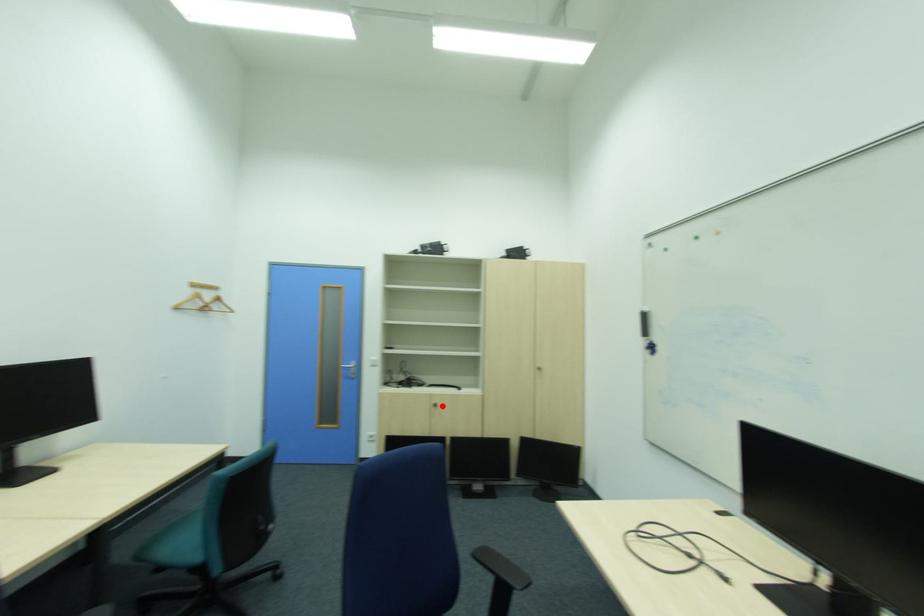
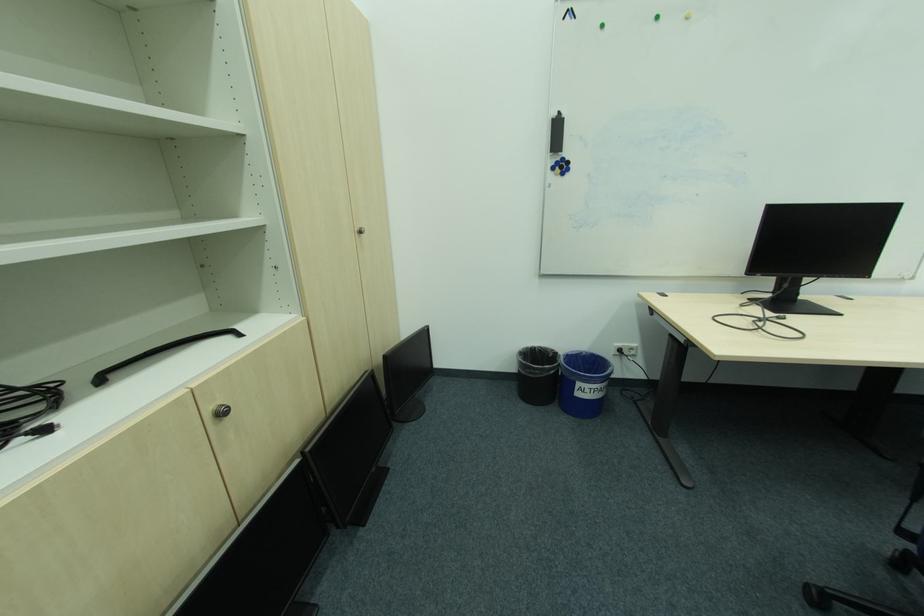
The point at the highlighted location is marked in the first image. Where is the corresponding point in the second image?

(227, 415)